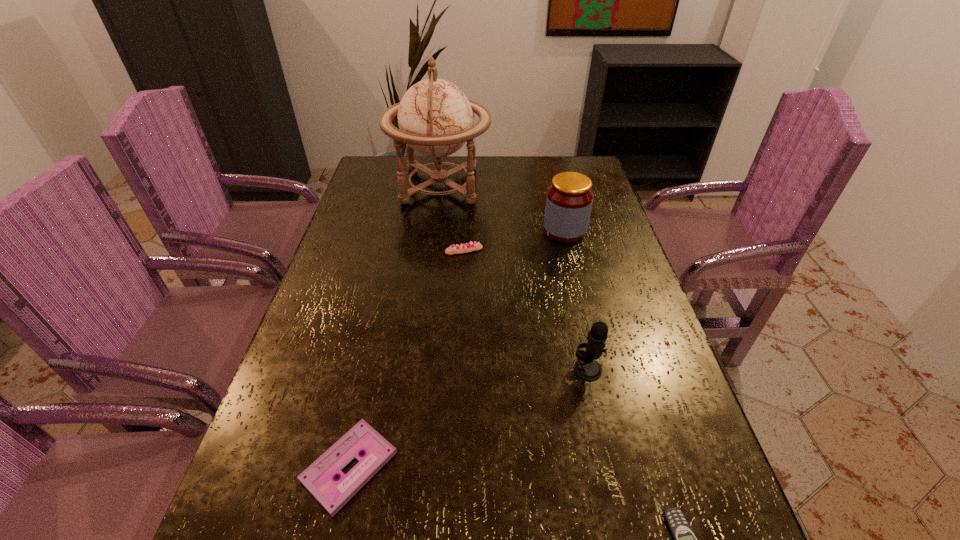
Locate an element on the screen. The height and width of the screenshot is (540, 960). the farthest object is located at coordinates (435, 118).

The height and width of the screenshot is (540, 960). Identify the location of globe. (435, 118).

Locate an element on the screen. The height and width of the screenshot is (540, 960). jar is located at coordinates (569, 199).

Where is `the third nearest object`? The image size is (960, 540). the third nearest object is located at coordinates (586, 367).

Where is `the fourth tallest object`? The width and height of the screenshot is (960, 540). the fourth tallest object is located at coordinates (468, 247).

I want to click on the fourth nearest object, so click(x=468, y=247).

You are a GUI agent. You are given a task and a screenshot of the screen. Output one action in this format:
    pyautogui.click(x=<x>, y=<y>)
    Task: Click on the videotape
    
    Given the screenshot: What is the action you would take?
    pyautogui.click(x=319, y=478)

Locate an element on the screen. Image resolution: width=960 pixels, height=540 pixels. vacant region located on the front-facing side of the tallest object is located at coordinates (572, 185).

I want to click on vacant point located 0.330m on the front of the jar, so click(x=588, y=329).

Locate an element on the screen. The width and height of the screenshot is (960, 540). blank space located on the back of the fourth farthest object is located at coordinates [568, 284].